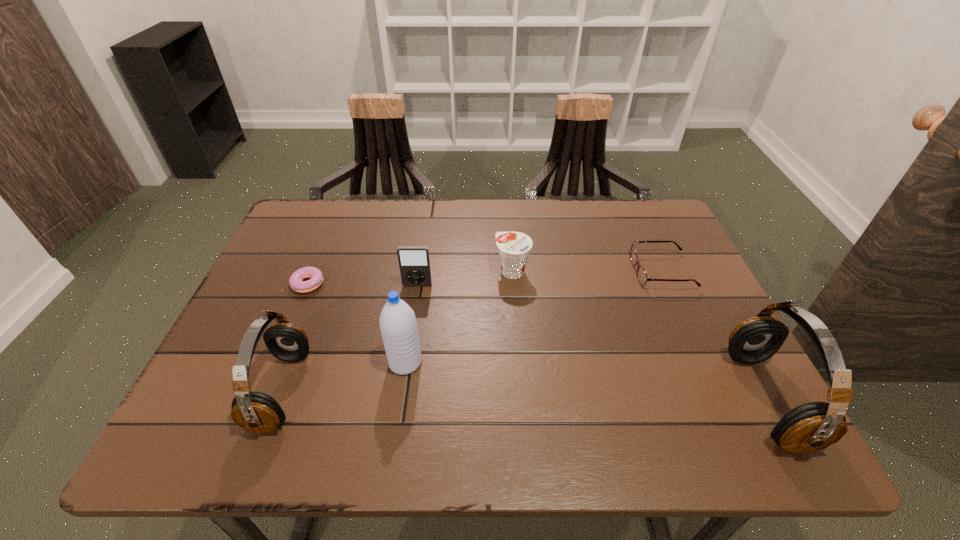
The image size is (960, 540). Find the location of `blank region between the sixth tallest object and the yogurt`. blank region between the sixth tallest object and the yogurt is located at coordinates (588, 271).

Where is `free space between the spectacles and the water bottle`? free space between the spectacles and the water bottle is located at coordinates coord(534,317).

Find the location of a particular element. The image size is (960, 540). object that is the third closest to the left headset is located at coordinates (414, 262).

Identify which object is located as the fifth nearest to the right headset. Please provide its 2D coordinates. Your answer should be formatted as a tuple, i.e. [(x, y)], where the tuple contains the x and y coordinates of a point satisfying the conditions above.

[(257, 412)]

Locate an element on the screen. vacant space that satisfies the following two spatial constraints: 1. on the back side of the doughnut; 2. on the right side of the yogurt is located at coordinates (312, 271).

Find the location of a particular element. The image size is (960, 540). free location that satisfies the following two spatial constraints: 1. on the lenses of the sixth tallest object; 2. on the front side of the yogurt is located at coordinates (662, 271).

Where is `free space that satisfies the following two spatial constraints: 1. on the front-facing side of the fourth shortest object; 2. on the ear cups of the left headset`? This screenshot has width=960, height=540. free space that satisfies the following two spatial constraints: 1. on the front-facing side of the fourth shortest object; 2. on the ear cups of the left headset is located at coordinates (401, 391).